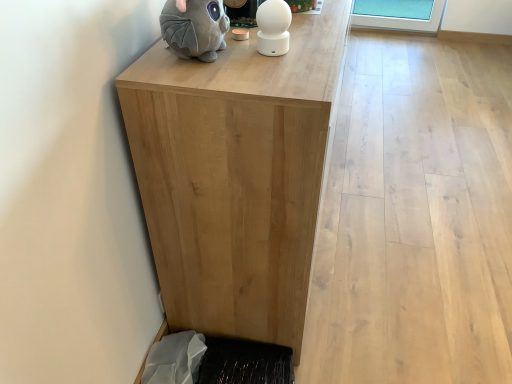
You are a GUI agent. You are given a task and a screenshot of the screen. Output one action in this format:
    pyautogui.click(x=<x>, y=<y>)
    Task: Click on the vacant area that lies to the right of gray plush toy at upper left
    This screenshot has height=384, width=512.
    Given the screenshot: What is the action you would take?
    pyautogui.click(x=287, y=57)